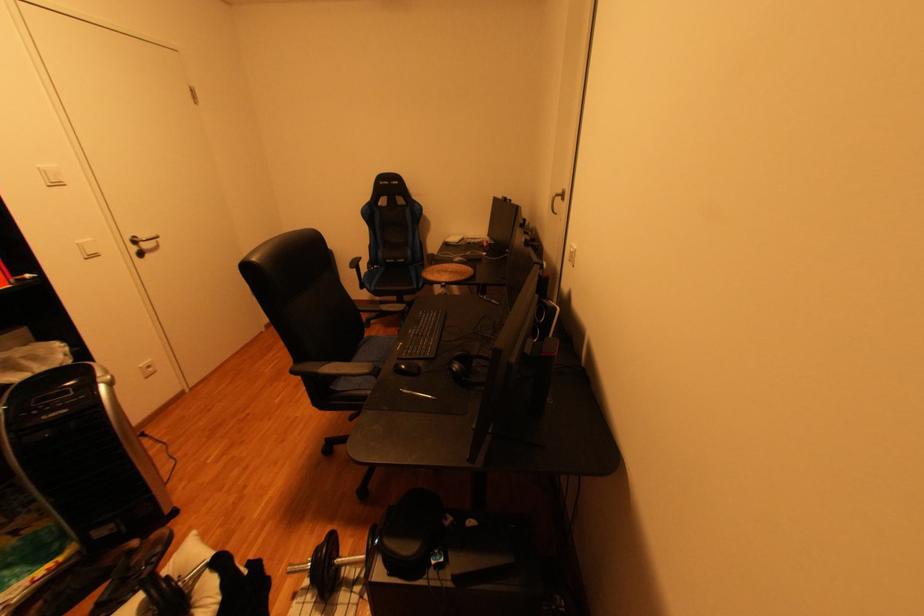
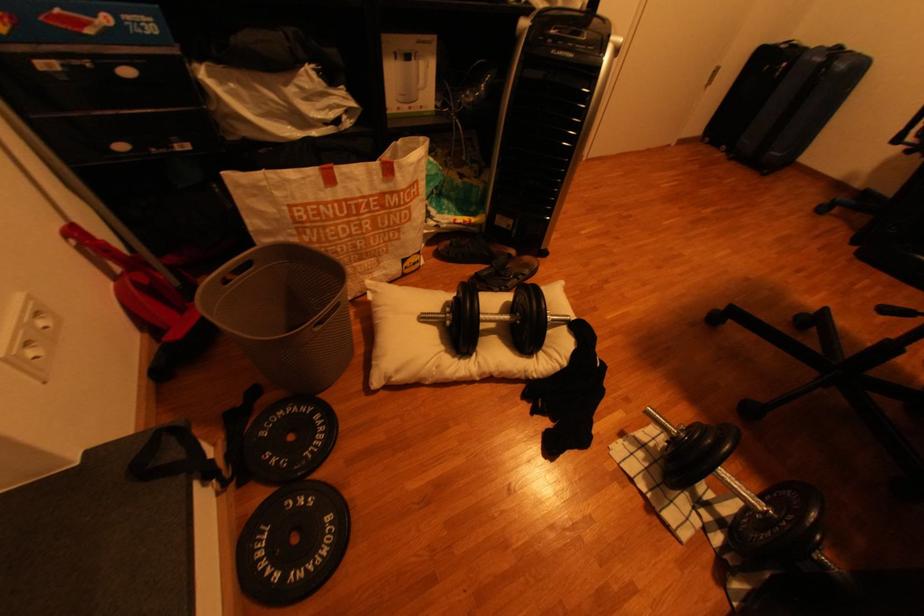
How did the camera likely rotate?

The camera's rotation is toward left-down.